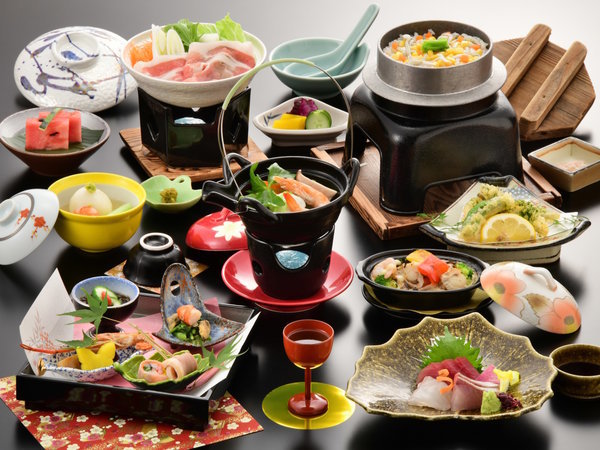
I want to click on plate, so click(x=513, y=361), click(x=565, y=233), click(x=102, y=84).